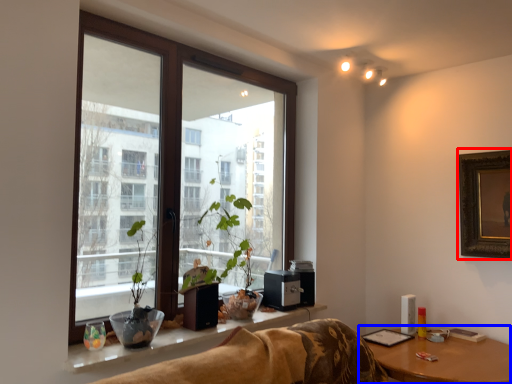
Question: Which of the following is the closest to the observer, picture frame (highlighted by a red box) or table (highlighted by a blue box)?

Choices:
 (A) picture frame
 (B) table

Answer: (B)